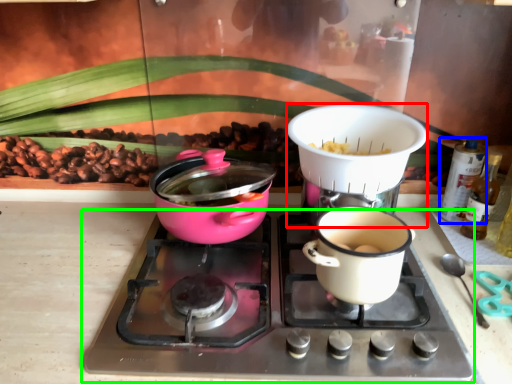
Question: Which object is positioned farthest from appliance (highlighted by a red box)? Select from bottle (highlighted by a blue box) and gas stove (highlighted by a green box).

Choices:
 (A) bottle
 (B) gas stove

Answer: (A)